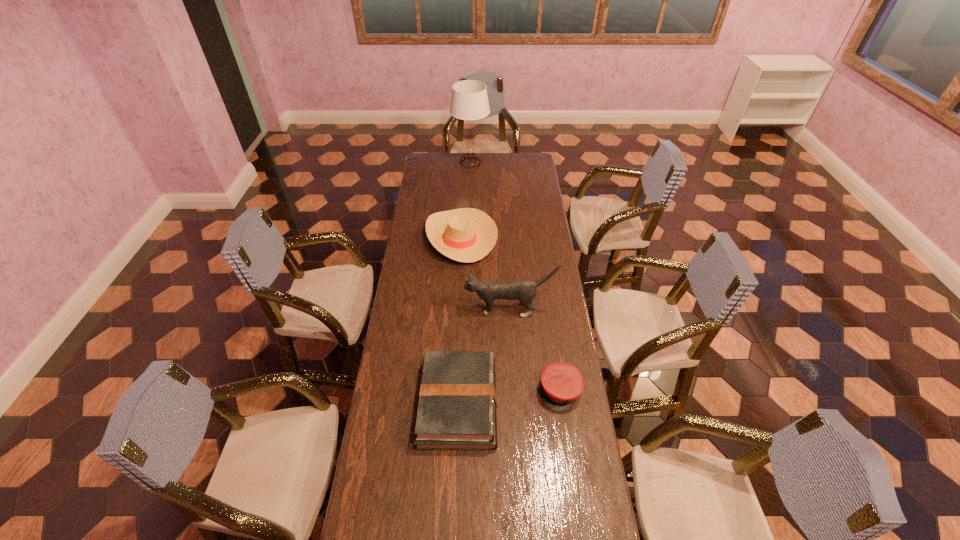
Find the location of a particular element. The height and width of the screenshot is (540, 960). the tallest object is located at coordinates (469, 101).

Identify the location of the farthest object. 469,101.

The width and height of the screenshot is (960, 540). In order to click on the third nearest object in this screenshot , I will do `click(525, 291)`.

The height and width of the screenshot is (540, 960). Identify the location of the second tallest object. (525, 291).

Locate an element on the screen. This screenshot has height=540, width=960. sunhat is located at coordinates (467, 235).

Image resolution: width=960 pixels, height=540 pixels. I want to click on hardback book, so [457, 402].

The height and width of the screenshot is (540, 960). I want to click on the shortest object, so click(x=561, y=383).

Where is `free region located on the front-facing side of the farthest object`? free region located on the front-facing side of the farthest object is located at coordinates (469, 211).

You are a GUI agent. You are given a task and a screenshot of the screen. Output one action in this format:
    pyautogui.click(x=<x>, y=<y>)
    Task: Click on the vacant area situated at the face of the third farthest object
    The width and height of the screenshot is (960, 540).
    Given the screenshot: What is the action you would take?
    pyautogui.click(x=419, y=309)

Identify the location of free spot located 0.290m at the face of the third farthest object. (398, 309).